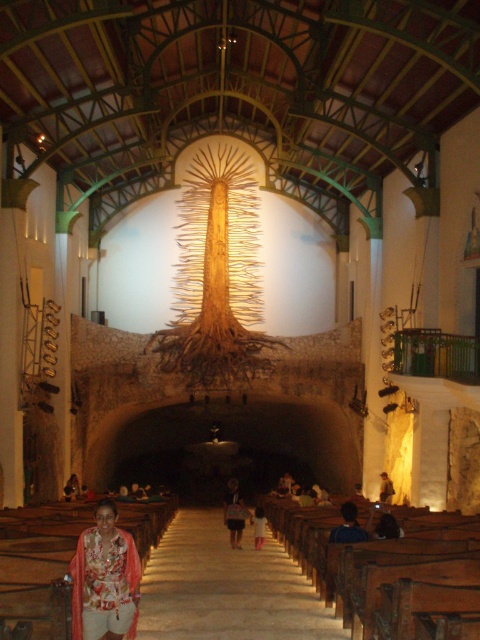
You are an event planner arranging a photoshoot in this church. You need to place a large banner that requires at least 3 meters of width. You have two options for placement areas based on the objects present. The first option is near the dark blue shirt at center, and the second is near the pink fabric at center. Which location would be more suitable for the banner based on their widths?

The dark blue shirt at center has a larger width than the pink fabric at center, so placing the banner near the dark blue shirt at center would be more suitable as it provides the necessary space for the 3 meter width requirement.

You are a visitor standing in the nave of the church. You see a denim jacket at center and a dark blue shirt at center. If you want to pick up both items, which one would you need to walk further to reach?

The denim jacket at center and dark blue shirt at center are 27.28 meters apart from each other, so you would need to walk further to reach whichever one is farther away. However, since both are at the center, their distance apart suggests they might be positioned in a way that requires moving between them, but the exact direction isn